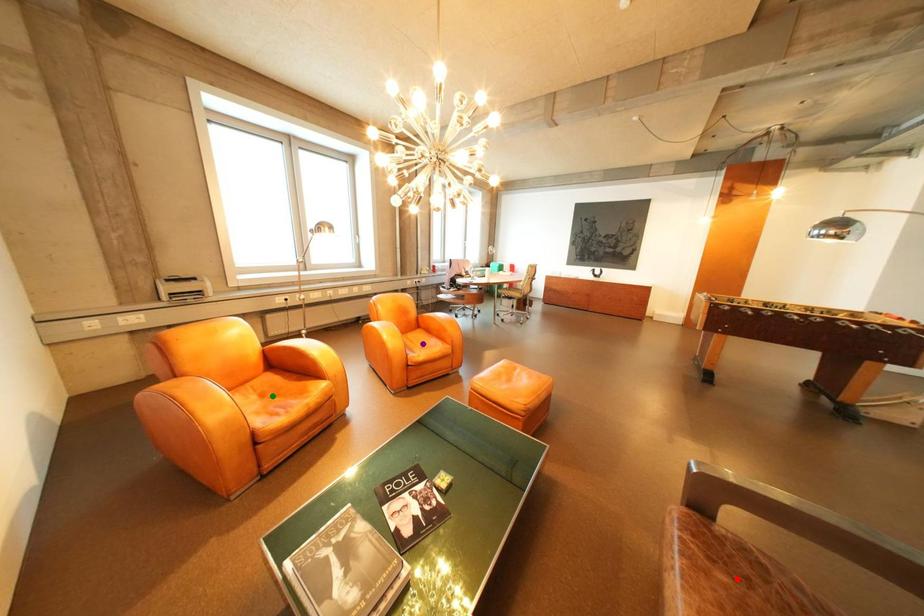
Order these from farthest to nearest:
red point
green point
purple point

purple point → green point → red point